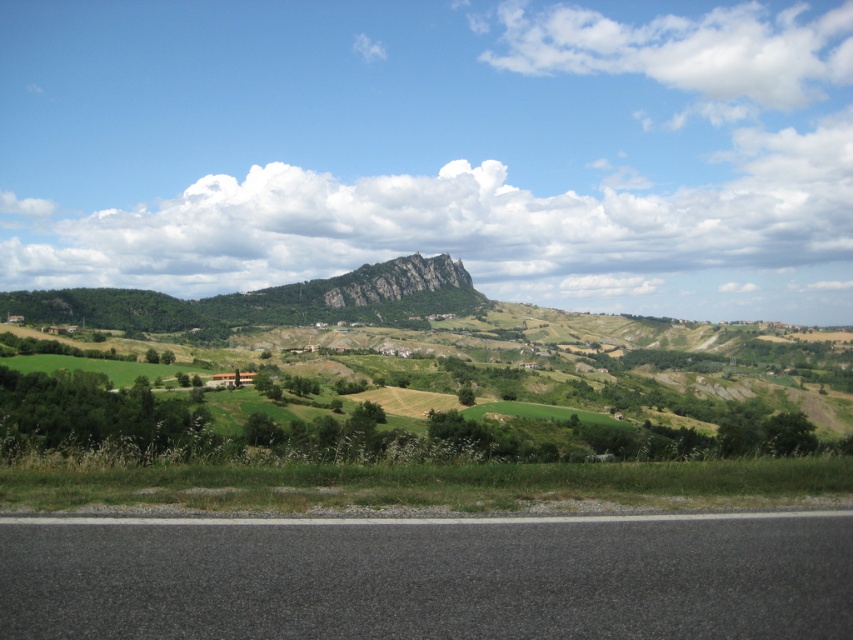
You are driving along the road in the rural landscape and want to reach a specific destination. You see two points marked in the scene, point 1 at coordinates point (234, 188) and point 2 at coordinates point (766, 36). Which point is closer to you as you drive along the road?

Point (234, 188) is closer to the viewer than point (766, 36), so the closer point is point 1 at coordinates point (234, 188).

Based on the photo, you are driving along the road in the foreground and notice the white fluffy cloud at upper center and the rugged stone mountain at center. Which object is higher in the sky?

The white fluffy cloud at upper center is higher in the sky than the rugged stone mountain at center because it is positioned over it.

You are a pilot flying a small plane and need to navigate around the white fluffy cloud at center. Based on the coordinates provided, can you determine if the cloud is positioned in the upper half or lower half of the image?

The white fluffy cloud at center is located at point (480, 230). Since the y coordinate 0.565 is above 0.5, it is in the upper half of the image.